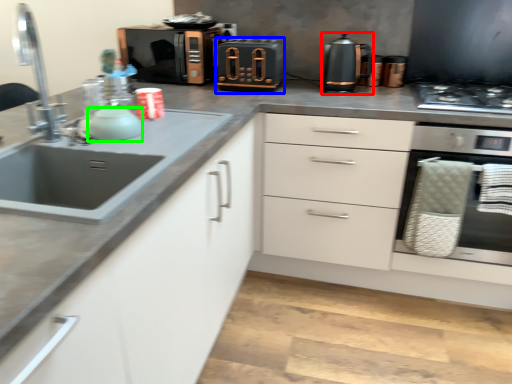
Question: Which is nearer to the kitchen appliance (highlighted by a red box)? appliance (highlighted by a blue box) or appliance (highlighted by a green box).

Choices:
 (A) appliance
 (B) appliance

Answer: (A)